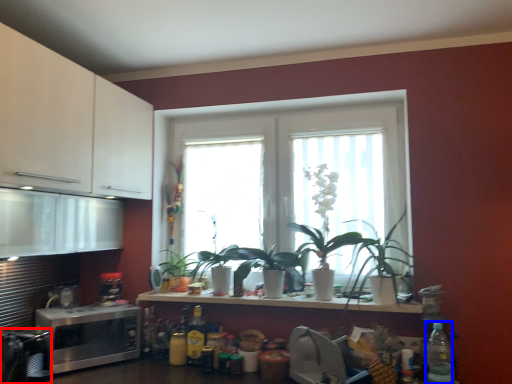
Question: Which point is closer to the camera, appliance (highlighted by a red box) or bottle (highlighted by a blue box)?

Choices:
 (A) appliance
 (B) bottle

Answer: (B)